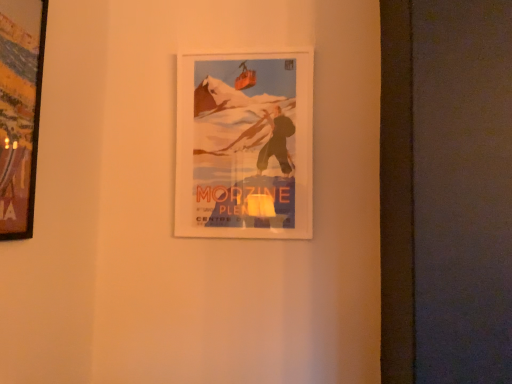
Question: Is matte paper poster at center, the 2th picture frame viewed from the front, in front of or behind wooden frame at left, which is counted as the 2th picture frame, starting from the right, in the image?

Choices:
 (A) front
 (B) behind

Answer: (B)

Question: From a real-world perspective, relative to wooden frame at left, which is counted as the second picture frame, starting from the back, is matte paper poster at center, which appears as the first picture frame when viewed from the back, vertically above or below?

Choices:
 (A) above
 (B) below

Answer: (A)

Question: Considering the positions of matte paper poster at center, the 2th picture frame viewed from the front, and wooden frame at left, which is counted as the 2th picture frame, starting from the right, in the image, is matte paper poster at center, the 2th picture frame viewed from the front, taller or shorter than wooden frame at left, which is counted as the 2th picture frame, starting from the right,?

Choices:
 (A) short
 (B) tall

Answer: (B)

Question: Is wooden frame at left, acting as the first picture frame starting from the front, spatially inside matte paper poster at center, the 2th picture frame viewed from the front, or outside of it?

Choices:
 (A) outside
 (B) inside

Answer: (A)

Question: Considering the relative positions of wooden frame at left, which is counted as the second picture frame, starting from the back, and matte paper poster at center, arranged as the second picture frame when viewed from the left, in the image provided, is wooden frame at left, which is counted as the second picture frame, starting from the back, to the left or to the right of matte paper poster at center, arranged as the second picture frame when viewed from the left,?

Choices:
 (A) left
 (B) right

Answer: (A)

Question: Looking at the image, does wooden frame at left, which is counted as the 2th picture frame, starting from the right, seem bigger or smaller compared to matte paper poster at center, which appears as the first picture frame when viewed from the back?

Choices:
 (A) big
 (B) small

Answer: (B)

Question: Is point click(35, 127) closer or farther from the camera than point click(189, 127)?

Choices:
 (A) closer
 (B) farther

Answer: (A)